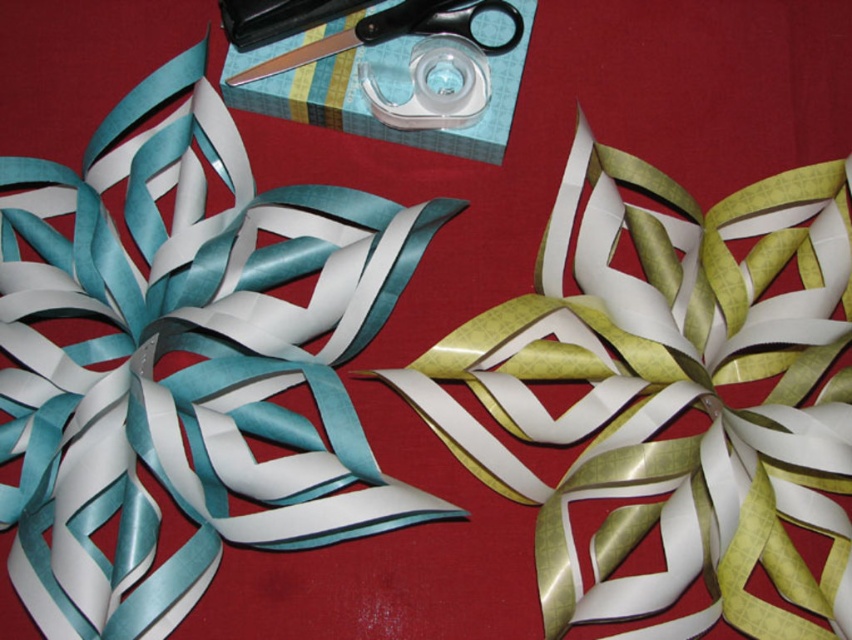
Question: Is gold shiny ribbon at center further to camera compared to black plastic scissors at upper center?

Choices:
 (A) yes
 (B) no

Answer: (B)

Question: Is gold shiny ribbon at center in front of black plastic scissors at upper center?

Choices:
 (A) yes
 (B) no

Answer: (A)

Question: In this image, where is gold shiny ribbon at center located relative to black plastic scissors at upper center?

Choices:
 (A) right
 (B) left

Answer: (A)

Question: Among these objects, which one is farthest from the camera?

Choices:
 (A) black plastic scissors at upper center
 (B) gold shiny ribbon at center

Answer: (A)

Question: Among these points, which one is nearest to the camera?

Choices:
 (A) (822, 408)
 (B) (383, 22)

Answer: (A)